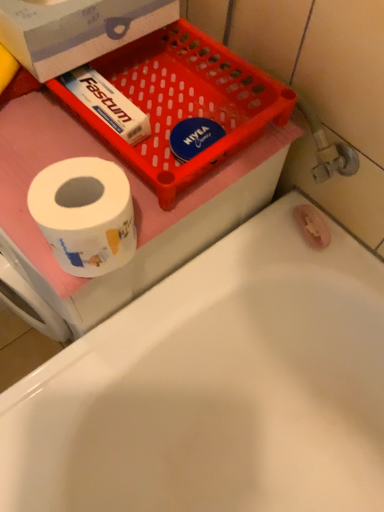
I want to click on free space behind white glossy toilet paper at left, so click(109, 148).